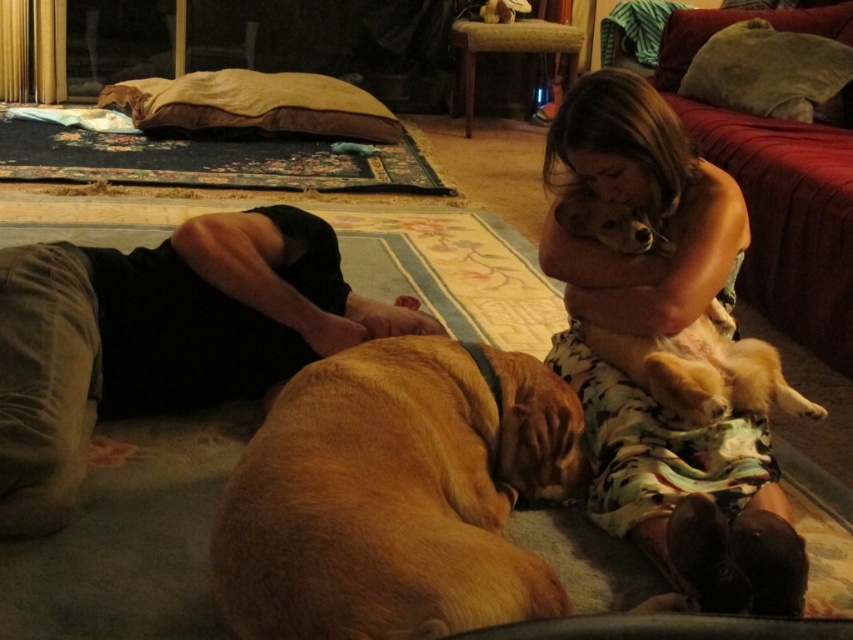
Question: Is the position of golden fur dog at center less distant than that of dark brown cotton pants at lower left?

Choices:
 (A) yes
 (B) no

Answer: (A)

Question: Among these objects, which one is farthest from the camera?

Choices:
 (A) fluffy brown dog at upper right
 (B) light brown fur at upper right
 (C) golden fur dog at center
 (D) dark brown cotton pants at lower left

Answer: (B)

Question: Which of the following is the farthest from the observer?

Choices:
 (A) (241, 376)
 (B) (596, 355)
 (C) (717, 333)
 (D) (318, 390)

Answer: (A)

Question: Does golden fur dog at center appear on the right side of fluffy brown dog at upper right?

Choices:
 (A) no
 (B) yes

Answer: (A)

Question: Which object is the farthest from the dark brown cotton pants at lower left?

Choices:
 (A) golden fur dog at center
 (B) fluffy brown dog at upper right
 (C) light brown fur at upper right

Answer: (C)

Question: Can you confirm if golden fur dog at center is bigger than light brown fur at upper right?

Choices:
 (A) yes
 (B) no

Answer: (A)